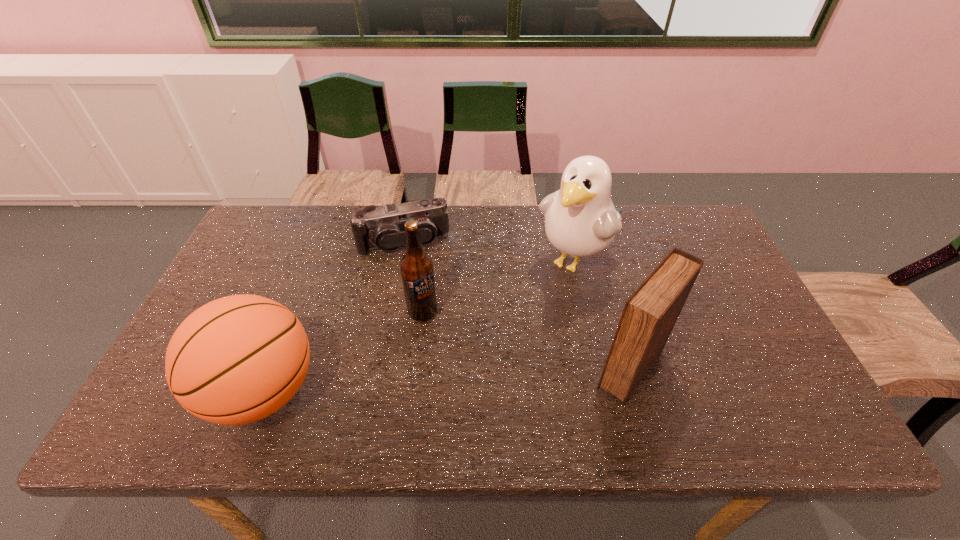
I want to click on free point that satisfies the following two spatial constraints: 1. on the back side of the camcorder; 2. on the right side of the basketball, so click(x=322, y=243).